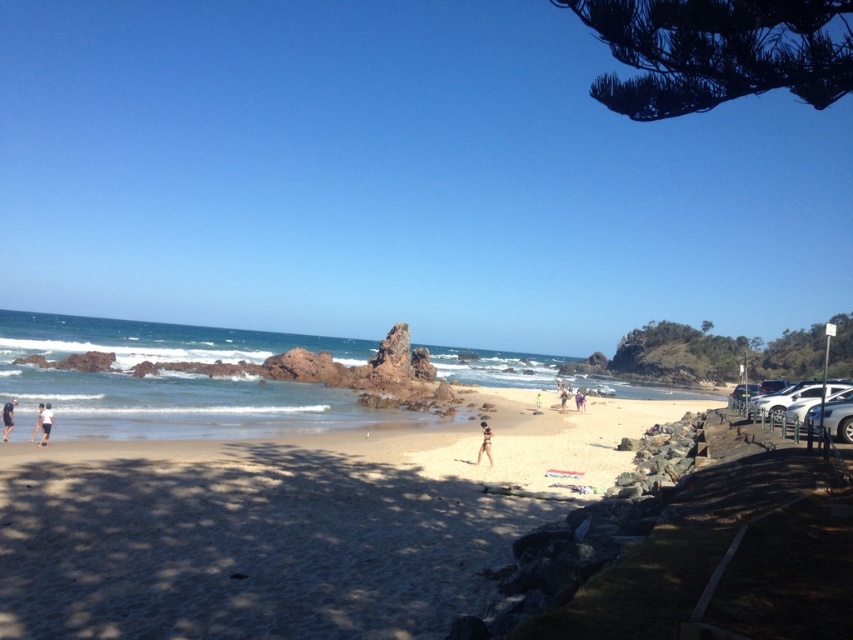
Question: Can you confirm if black fabric person at lower left is thinner than tan skin person at center?

Choices:
 (A) no
 (B) yes

Answer: (B)

Question: Considering the real-world distances, which object is closest to the smooth sand beach at center?

Choices:
 (A) beige sandy beach at center
 (B) tan skin person at center
 (C) matte white shorts at lower left
 (D) tan skin person at lower left

Answer: (A)

Question: Which point appears farthest from the camera in this image?

Choices:
 (A) (91, 508)
 (B) (33, 435)
 (C) (485, 451)

Answer: (C)

Question: Is black fabric person at lower left in front of tan skin person at center?

Choices:
 (A) yes
 (B) no

Answer: (A)

Question: Does matte white shorts at lower left appear under tan skin person at lower left?

Choices:
 (A) yes
 (B) no

Answer: (B)

Question: Which object appears closest to the camera in this image?

Choices:
 (A) beige sandy beach at center
 (B) tan skin person at center

Answer: (A)